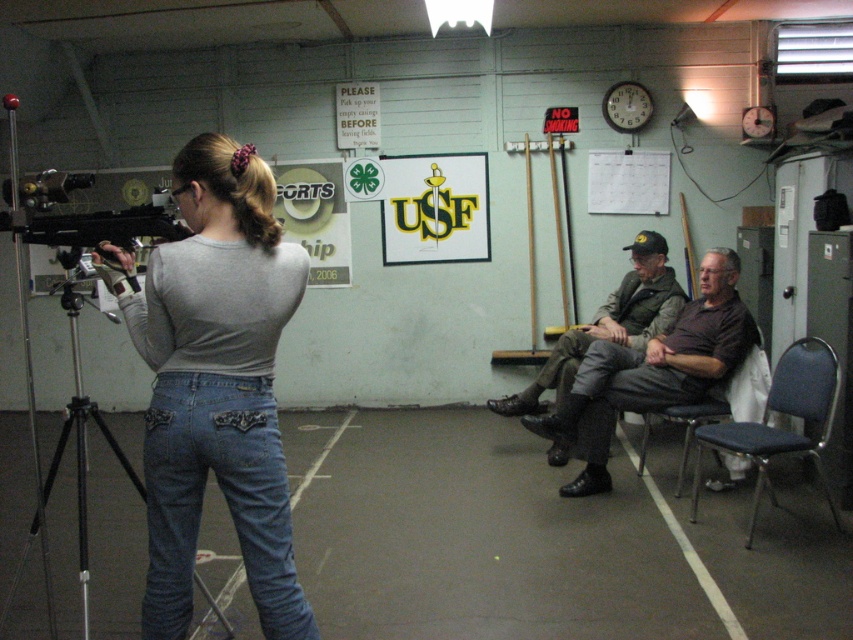
You are a photographer setting up a shoot in this indoor shooting range. You have a camera that can only focus on objects wider than 50 cm. You see the dark brown leather jacket at center and the denim at right. Which object should you focus on to ensure proper focus?

The dark brown leather jacket at center has a larger width than the denim at right, so you should focus on the dark brown leather jacket at center to ensure proper focus since it meets the camera requirement of being wider than 50 cm.

You are a photographer trying to capture a photo of the denim jeans at center and denim at left. Which piece of clothing is located to the right of the other?

The denim jeans at center is positioned on the left side of denim at left, so the denim at left is to the right of denim jeans at center.